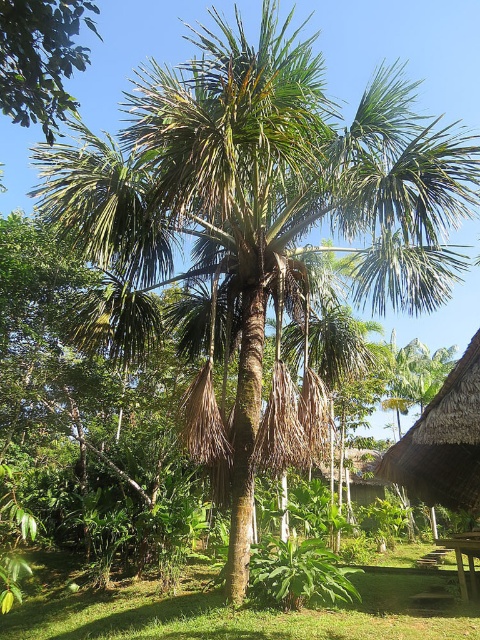
This screenshot has height=640, width=480. Describe the element at coordinates (238, 609) in the screenshot. I see `green grass at center` at that location.

Can you confirm if green grass at center is bigger than thatched roof hut at lower right?

Indeed, green grass at center has a larger size compared to thatched roof hut at lower right.

Is point (54, 604) positioned after point (455, 493)?

Yes, it is behind point (455, 493).

Image resolution: width=480 pixels, height=640 pixels. Find the location of `green grass at center`. green grass at center is located at coordinates (238, 609).

Can you confirm if green grass at center is taller than green leafy tree at upper left?

No.

The image size is (480, 640). Identify the location of green grass at center. (238, 609).

Looking at this image, is green leafy tree at upper left bigger than wooden picnic table at lower right?

Indeed, green leafy tree at upper left has a larger size compared to wooden picnic table at lower right.

Can you confirm if green leafy tree at upper left is taller than wooden picnic table at lower right?

Correct, green leafy tree at upper left is much taller as wooden picnic table at lower right.

Find the location of `green leafy tree at upper left`. green leafy tree at upper left is located at coordinates (41, 58).